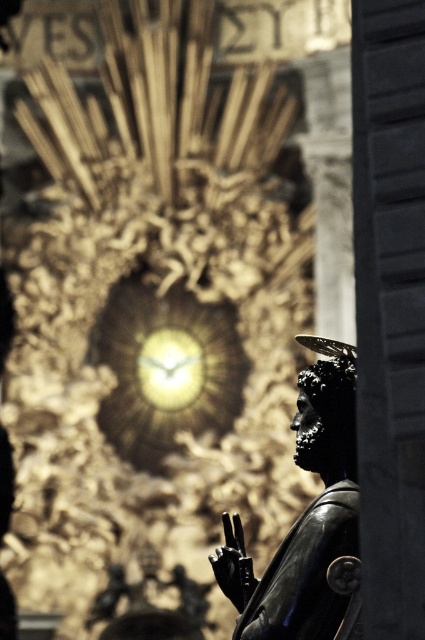
Question: Which of the following is the closest to the observer?

Choices:
 (A) (195, 340)
 (B) (342, 532)

Answer: (B)

Question: From the image, what is the correct spatial relationship of polished bronze statue at lower right in relation to gold metallic clock at center?

Choices:
 (A) above
 (B) below

Answer: (B)

Question: Is polished bronze statue at lower right smaller than gold metallic clock at center?

Choices:
 (A) no
 (B) yes

Answer: (A)

Question: Does polished bronze statue at lower right appear under gold metallic clock at center?

Choices:
 (A) yes
 (B) no

Answer: (A)